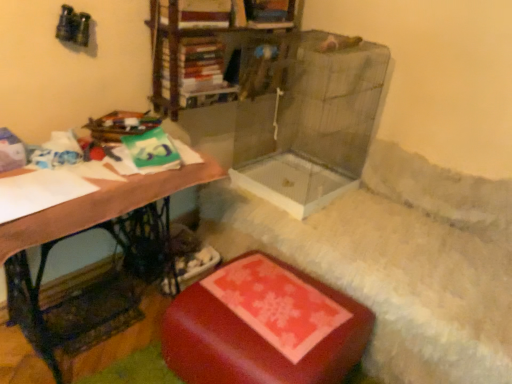
Question: Can you confirm if rubberized red ottoman at lower center is shorter than wooden desk at left?

Choices:
 (A) no
 (B) yes

Answer: (B)

Question: Is rubberized red ottoman at lower center far away from wooden desk at left?

Choices:
 (A) no
 (B) yes

Answer: (A)

Question: Considering the relative sizes of rubberized red ottoman at lower center and wooden desk at left in the image provided, is rubberized red ottoman at lower center smaller than wooden desk at left?

Choices:
 (A) yes
 (B) no

Answer: (A)

Question: Does rubberized red ottoman at lower center appear on the left side of wooden desk at left?

Choices:
 (A) yes
 (B) no

Answer: (B)

Question: Are rubberized red ottoman at lower center and wooden desk at left making contact?

Choices:
 (A) no
 (B) yes

Answer: (A)

Question: Considering the positions of point (x=68, y=226) and point (x=302, y=278), is point (x=68, y=226) closer or farther from the camera than point (x=302, y=278)?

Choices:
 (A) closer
 (B) farther

Answer: (A)

Question: Considering the positions of wooden desk at left and rubberized red ottoman at lower center in the image, is wooden desk at left bigger or smaller than rubberized red ottoman at lower center?

Choices:
 (A) small
 (B) big

Answer: (B)

Question: Is wooden desk at left taller or shorter than rubberized red ottoman at lower center?

Choices:
 (A) short
 (B) tall

Answer: (B)

Question: In the image, is wooden desk at left on the left side or the right side of rubberized red ottoman at lower center?

Choices:
 (A) left
 (B) right

Answer: (A)

Question: In the image, is rubberized red ottoman at lower center on the left side or the right side of wooden desk at left?

Choices:
 (A) right
 (B) left

Answer: (A)

Question: Looking at their shapes, would you say rubberized red ottoman at lower center is wider or thinner than wooden desk at left?

Choices:
 (A) wide
 (B) thin

Answer: (A)

Question: Considering the positions of point (221, 321) and point (193, 180), is point (221, 321) closer or farther from the camera than point (193, 180)?

Choices:
 (A) farther
 (B) closer

Answer: (B)

Question: Considering the positions of rubberized red ottoman at lower center and wooden desk at left in the image, is rubberized red ottoman at lower center bigger or smaller than wooden desk at left?

Choices:
 (A) small
 (B) big

Answer: (A)

Question: From a real-world perspective, is hardcover book at upper center above or below wooden desk at left?

Choices:
 (A) below
 (B) above

Answer: (B)

Question: Is hardcover book at upper center wider or thinner than wooden desk at left?

Choices:
 (A) wide
 (B) thin

Answer: (B)